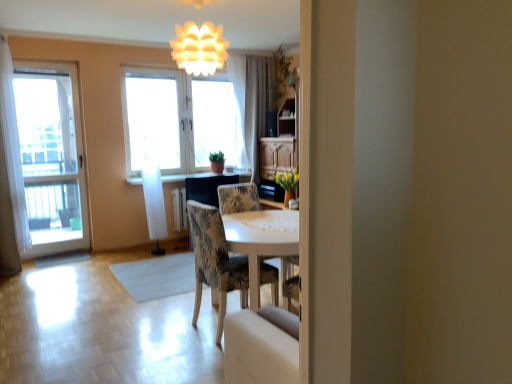
Find the location of a particular element. white matte light fixture at upper center is located at coordinates (199, 48).

This screenshot has width=512, height=384. Describe the element at coordinates (206, 175) in the screenshot. I see `matte black counter top at center` at that location.

Where is `translucent fabric window at center, acting as the 1th window starting from the back`? translucent fabric window at center, acting as the 1th window starting from the back is located at coordinates (179, 121).

Is white matte light fixture at upper center positioned with its back to translucent fabric window at center, which appears as the 1th window when viewed from the right?

No, translucent fabric window at center, which appears as the 1th window when viewed from the right, is not at the back of white matte light fixture at upper center.

How many degrees apart are the facing directions of white matte light fixture at upper center and translucent fabric window at center, the second window positioned from the front?

90.1 degrees.

Is translucent fabric window at center, the second window viewed from the left, inside white matte light fixture at upper center?

No, translucent fabric window at center, the second window viewed from the left, is not inside white matte light fixture at upper center.

Is white matte light fixture at upper center to the right of translucent fabric window at center, the second window positioned from the front, from the viewer's perspective?

A: Yes.

From a real-world perspective, between white matte light fixture at upper center and transparent glass door at left, which is the second window from back to front, who is vertically lower?

transparent glass door at left, which is the second window from back to front, from a real-world perspective.

Is white matte light fixture at upper center to the right of transparent glass door at left, which ranks as the 2th window in right-to-left order, from the viewer's perspective?

Yes.

Is white matte light fixture at upper center not within transparent glass door at left, which is the 1th window from front to back?

Yes, white matte light fixture at upper center is outside of transparent glass door at left, which is the 1th window from front to back.

Does matte black counter top at center have a greater width compared to patterned fabric chair at center?

No.

Between matte black counter top at center and patterned fabric chair at center, which one is positioned behind?

Positioned behind is matte black counter top at center.

Which is more to the right, matte black counter top at center or patterned fabric chair at center?

Positioned to the right is patterned fabric chair at center.

Between transparent glass door at left, which ranks as the 2th window in right-to-left order, and white sheer curtain at left, placed as the second curtain when sorted from right to left, which one appears on the right side from the viewer's perspective?

Positioned to the right is transparent glass door at left, which ranks as the 2th window in right-to-left order.

Which is further, (x=24, y=78) or (x=1, y=84)?

The point (x=24, y=78) is more distant.

From the image's perspective, is transparent glass door at left, which is the second window from back to front, above or below white sheer curtain at left, positioned as the 1th curtain in front-to-back order?

From the image's perspective, transparent glass door at left, which is the second window from back to front, appears above white sheer curtain at left, positioned as the 1th curtain in front-to-back order.

Would you say transparent glass door at left, which is the second window from back to front, is inside or outside white sheer curtain at left, positioned as the 1th curtain in front-to-back order?

transparent glass door at left, which is the second window from back to front, is outside white sheer curtain at left, positioned as the 1th curtain in front-to-back order.

Is translucent fabric window at center, the second window viewed from the left, positioned in front of patterned fabric chair at center?

No, translucent fabric window at center, the second window viewed from the left, is further to the viewer.

Is translucent fabric window at center, the second window positioned from the front, looking in the opposite direction of patterned fabric chair at center?

No, translucent fabric window at center, the second window positioned from the front, is not facing the opposite direction of patterned fabric chair at center.

Consider the image. From a real-world perspective, which object rests below the other?

patterned fabric chair at center is physically lower.

From their relative heights in the image, would you say translucent fabric window at center, acting as the 1th window starting from the back, is taller or shorter than patterned fabric chair at center?

Clearly, translucent fabric window at center, acting as the 1th window starting from the back, is taller compared to patterned fabric chair at center.

Who is more distant, white sheer curtain at left, placed as the second curtain when sorted from right to left, or white sheer curtain at upper center, positioned as the second curtain in left-to-right order?

white sheer curtain at upper center, positioned as the second curtain in left-to-right order, is further from the camera.

Based on the photo, considering the sizes of objects white sheer curtain at left, placed as the 2th curtain when sorted from back to front, and white sheer curtain at upper center, which is counted as the second curtain, starting from the front, in the image provided, who is taller, white sheer curtain at left, placed as the 2th curtain when sorted from back to front, or white sheer curtain at upper center, which is counted as the second curtain, starting from the front,?

With more height is white sheer curtain at left, placed as the 2th curtain when sorted from back to front.

Which is behind, point (25, 208) or point (244, 109)?

Point (244, 109)

Measure the distance from white sheer curtain at upper center, positioned as the second curtain in left-to-right order, to transparent glass door at left, acting as the 1th window starting from the left.

7.60 feet.

Is white sheer curtain at upper center, which is the first curtain from back to front, positioned with its back to transparent glass door at left, acting as the 1th window starting from the left?

That's not correct — white sheer curtain at upper center, which is the first curtain from back to front, is not looking away from transparent glass door at left, acting as the 1th window starting from the left.

From the white sheer curtain at upper center, positioned as the second curtain in left-to-right order, count the 2nd window to the left and point to it. Please provide its 2D coordinates.

[(51, 155)]

From the picture: From a real-world perspective, which object stands above the other?

white sheer curtain at upper center, which is counted as the second curtain, starting from the front.

From the image's perspective, count 1st windows downward from the white matte light fixture at upper center and point to it. Please provide its 2D coordinates.

[(179, 121)]

Where is `the 2nd window directly beneath the white matte light fixture at upper center (from a real-world perspective)`? the 2nd window directly beneath the white matte light fixture at upper center (from a real-world perspective) is located at coordinates (51, 155).

Based on the photo, considering their positions, is translucent fabric window at center, the second window viewed from the left, positioned further to matte black counter top at center than white matte light fixture at upper center?

white matte light fixture at upper center is further to matte black counter top at center.

When comparing their distances from translucent fabric window at center, the second window positioned from the front, does transparent glass door at left, which is the second window from back to front, or white sheer curtain at left, which is counted as the 1th curtain, starting from the left, seem further?

white sheer curtain at left, which is counted as the 1th curtain, starting from the left, lies further to translucent fabric window at center, the second window positioned from the front, than the other object.

Estimate the real-world distances between objects in this image. Which object is further from transparent glass door at left, which is the 1th window from front to back, white sheer curtain at left, placed as the 2th curtain when sorted from back to front, or white sheer curtain at upper center, which is counted as the second curtain, starting from the front?

white sheer curtain at upper center, which is counted as the second curtain, starting from the front, is further to transparent glass door at left, which is the 1th window from front to back.

Which object lies further to the anchor point translucent fabric window at center, the second window viewed from the left, patterned fabric chair at center or white matte light fixture at upper center?

patterned fabric chair at center lies further to translucent fabric window at center, the second window viewed from the left, than the other object.

Considering their positions, is white sheer curtain at upper center, positioned as the second curtain in left-to-right order, positioned further to white sheer curtain at left, placed as the second curtain when sorted from right to left, than transparent glass door at left, acting as the 1th window starting from the left?

white sheer curtain at upper center, positioned as the second curtain in left-to-right order, is positioned further to the anchor white sheer curtain at left, placed as the second curtain when sorted from right to left.

Which object lies nearer to the anchor point matte black counter top at center, translucent fabric window at center, which appears as the 1th window when viewed from the right, or transparent glass door at left, acting as the 1th window starting from the left?

Based on the image, translucent fabric window at center, which appears as the 1th window when viewed from the right, appears to be nearer to matte black counter top at center.

Consider the image. Considering their positions, is translucent fabric window at center, the second window positioned from the front, positioned closer to white sheer curtain at upper center, which is the first curtain from back to front, than patterned fabric chair at center?

Among the two, translucent fabric window at center, the second window positioned from the front, is located nearer to white sheer curtain at upper center, which is the first curtain from back to front.

Based on their spatial positions, is transparent glass door at left, which is the 1th window from front to back, or matte black counter top at center further from white sheer curtain at left, placed as the 2th curtain when sorted from back to front?

matte black counter top at center.

Where is `fixture between white sheer curtain at left, placed as the 2th curtain when sorted from back to front, and white sheer curtain at upper center, which is the first curtain from back to front, in the horizontal direction`? fixture between white sheer curtain at left, placed as the 2th curtain when sorted from back to front, and white sheer curtain at upper center, which is the first curtain from back to front, in the horizontal direction is located at coordinates (199, 48).

Where is `fixture located between patterned fabric chair at center and translucent fabric window at center, the second window positioned from the front, in the depth direction`? The height and width of the screenshot is (384, 512). fixture located between patterned fabric chair at center and translucent fabric window at center, the second window positioned from the front, in the depth direction is located at coordinates (199, 48).

Find the location of `counter top between white sheer curtain at left, placed as the 2th curtain when sorted from back to front, and white matte light fixture at upper center from left to right`. counter top between white sheer curtain at left, placed as the 2th curtain when sorted from back to front, and white matte light fixture at upper center from left to right is located at coordinates (206, 175).

Where is `window between transparent glass door at left, which is the second window from back to front, and matte black counter top at center`? window between transparent glass door at left, which is the second window from back to front, and matte black counter top at center is located at coordinates (179, 121).